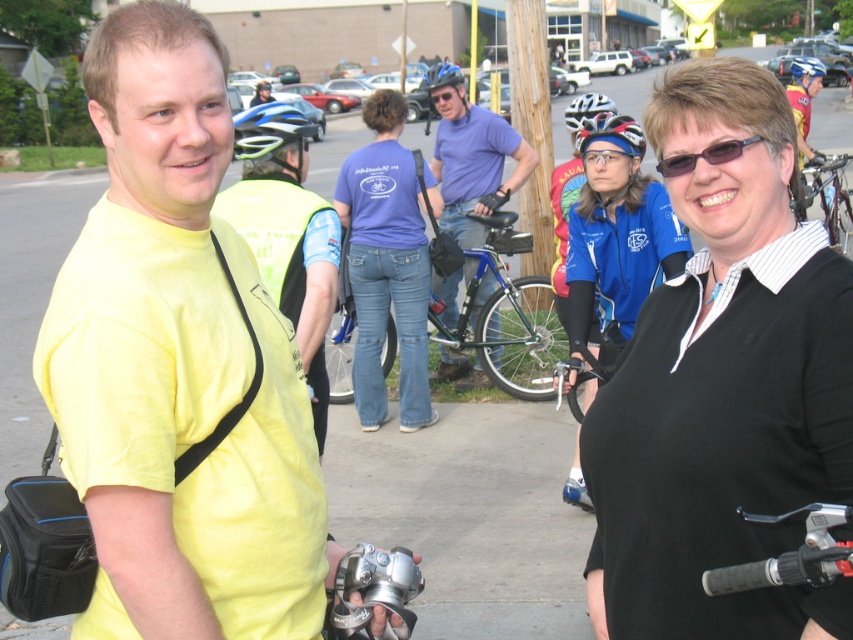
Question: Where is shiny black helmet at center located in relation to clear plastic goggles at center in the image?

Choices:
 (A) above
 (B) below

Answer: (B)

Question: Is blue metallic bicycle at center behind matte blue helmet at center?

Choices:
 (A) no
 (B) yes

Answer: (A)

Question: Among these objects, which one is nearest to the camera?

Choices:
 (A) matte blue helmet at center
 (B) white matte bicycle helmet at upper center
 (C) yellow matte shirt at left
 (D) matte blue shirt at center

Answer: (C)

Question: Among these objects, which one is farthest from the camera?

Choices:
 (A) blue cotton shirt at center
 (B) matte blue shirt at center

Answer: (B)

Question: Which object is the farthest from the yellow matte shirt at left?

Choices:
 (A) blue metallic bicycle at center
 (B) blue jersey at center
 (C) matte blue helmet at center

Answer: (C)

Question: Can you confirm if shiny black helmet at center is wider than matte blue helmet at center?

Choices:
 (A) yes
 (B) no

Answer: (B)